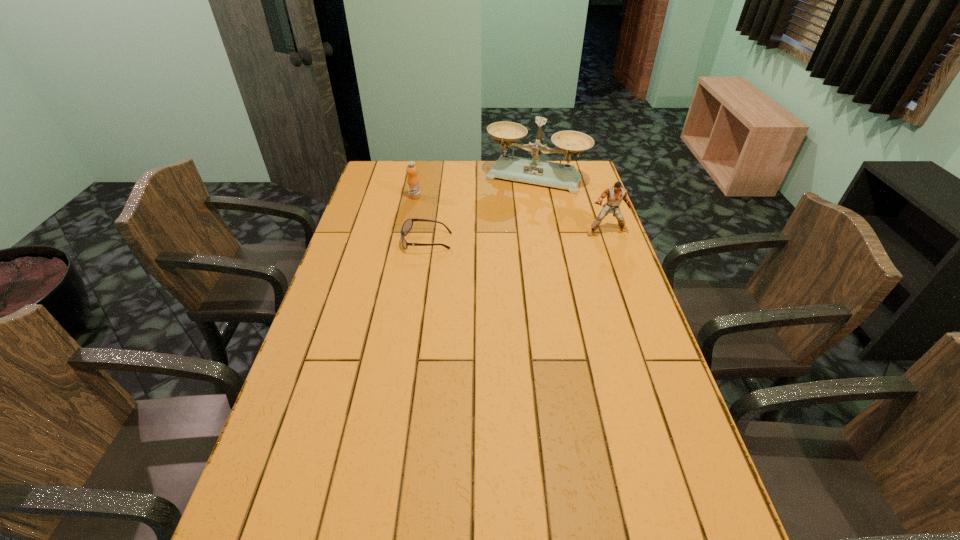
Locate an element on the screen. This screenshot has height=540, width=960. blank area located on the front-facing side of the scale is located at coordinates (494, 247).

The height and width of the screenshot is (540, 960). I want to click on free location located on the front label of the orange juice, so click(x=435, y=202).

Locate an element on the screen. vacant space located on the front label of the orange juice is located at coordinates (462, 211).

Where is `vacant region located 0.190m on the front label of the orange juice`? The height and width of the screenshot is (540, 960). vacant region located 0.190m on the front label of the orange juice is located at coordinates (462, 211).

Find the location of a particular element. This screenshot has width=960, height=540. object positioned at the far edge is located at coordinates (534, 171).

Where is `puncher located at the right edge`? puncher located at the right edge is located at coordinates (615, 195).

Where is `scale at the right edge`? This screenshot has height=540, width=960. scale at the right edge is located at coordinates (534, 171).

I want to click on object present at the far right corner, so click(534, 171).

Find the location of a particular element. The image size is (960, 540). free space at the far edge of the desktop is located at coordinates (462, 187).

Image resolution: width=960 pixels, height=540 pixels. What are the coordinates of `vacant space at the left edge of the desktop` in the screenshot? It's located at (364, 238).